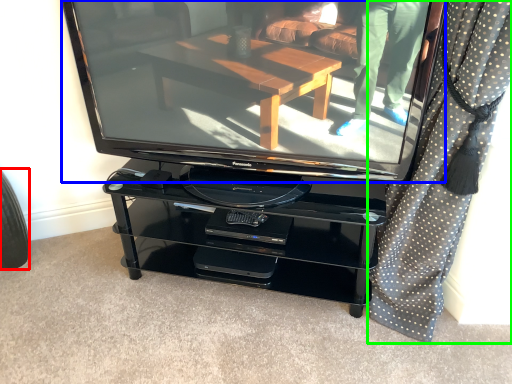
Question: Estimate the real-world distances between objects in this image. Which object is closer to tire (highlighted by a red box), television (highlighted by a blue box) or curtain (highlighted by a green box)?

Choices:
 (A) television
 (B) curtain

Answer: (A)